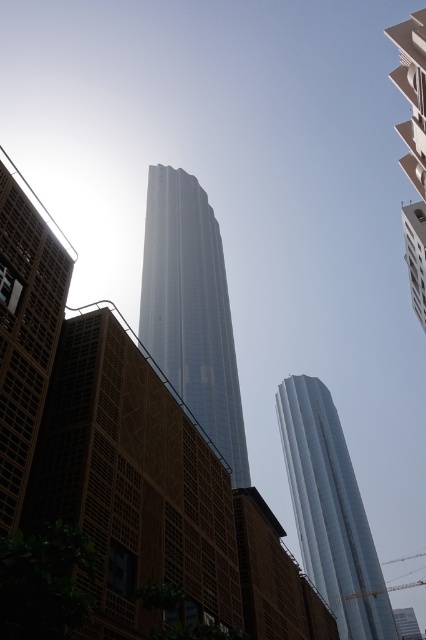
Question: Among these points, which one is farthest from the camera?

Choices:
 (A) (3, 260)
 (B) (405, 246)
 (C) (215, 230)
 (D) (417, 230)

Answer: (C)

Question: Is shiny glass tower at center positioned at the back of white glossy building at upper right?

Choices:
 (A) no
 (B) yes

Answer: (B)

Question: Is brown textured wall at left smaller than white glossy building at upper right?

Choices:
 (A) no
 (B) yes

Answer: (B)

Question: Is white glossy building at upper right closer to the viewer compared to smooth glass tower at upper center?

Choices:
 (A) no
 (B) yes

Answer: (B)

Question: Among these points, which one is nearest to the camera?

Choices:
 (A) [402, 90]
 (B) [296, 493]
 (C) [9, 429]

Answer: (C)

Question: Considering the real-world distances, which object is farthest from the smooth glass tower at upper center?

Choices:
 (A) brown textured wall at left
 (B) white glossy building at upper right
 (C) silver metallic tower at center
 (D) shiny glass tower at center

Answer: (C)